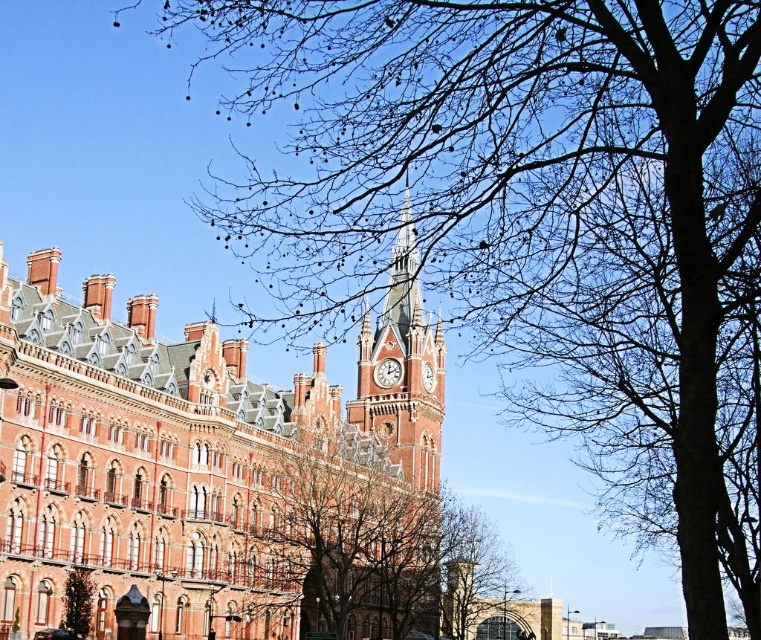
Between red brick clock tower at center and white glossy clock at center, which one is positioned higher?

red brick clock tower at center

Between red brick clock tower at center and white glossy clock at center, which one has more height?

red brick clock tower at center is taller.

Describe the element at coordinates (403, 371) in the screenshot. I see `red brick clock tower at center` at that location.

I want to click on red brick clock tower at center, so click(x=403, y=371).

Is bare branches at center wider than polished brass clock at center?

Correct, the width of bare branches at center exceeds that of polished brass clock at center.

Is point (260, 566) closer to viewer compared to point (396, 376)?

Yes, it is.

Is point (409, 547) more distant than point (374, 369)?

No, (409, 547) is in front of (374, 369).

Locate an element on the screen. The height and width of the screenshot is (640, 761). bare branches at center is located at coordinates (361, 541).

In the scene shown: Measure the distance between bare branches at center and white glossy clock at center.

The distance of bare branches at center from white glossy clock at center is 26.63 meters.

Does bare branches at center appear over white glossy clock at center?

Incorrect, bare branches at center is not positioned above white glossy clock at center.

Locate an element on the screen. This screenshot has width=761, height=640. bare branches at center is located at coordinates (361, 541).

Identify the location of bare branches at center. (361, 541).